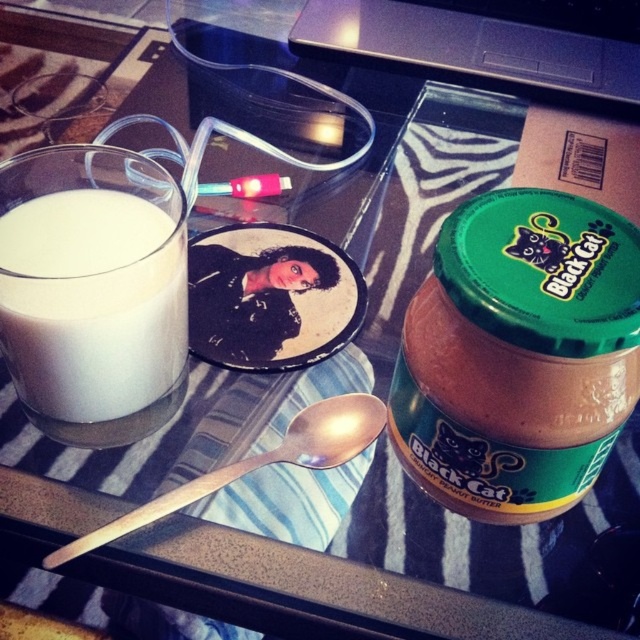
Question: Considering the real-world distances, which object is closest to the white matte glass at left?

Choices:
 (A) wooden spoon at center
 (B) brown smooth peanut butter jar at center right

Answer: (A)

Question: Can you confirm if white matte glass at left is positioned to the right of wooden spoon at center?

Choices:
 (A) yes
 (B) no

Answer: (B)

Question: Observing the image, what is the correct spatial positioning of white matte glass at left in reference to wooden spoon at center?

Choices:
 (A) below
 (B) above

Answer: (B)

Question: From the image, what is the correct spatial relationship of brown smooth peanut butter jar at center right in relation to wooden spoon at center?

Choices:
 (A) above
 (B) below

Answer: (A)

Question: Which of these objects is positioned farthest from the brown smooth peanut butter jar at center right?

Choices:
 (A) white matte glass at left
 (B) wooden spoon at center

Answer: (A)

Question: Among these objects, which one is nearest to the camera?

Choices:
 (A) wooden spoon at center
 (B) white matte glass at left

Answer: (B)